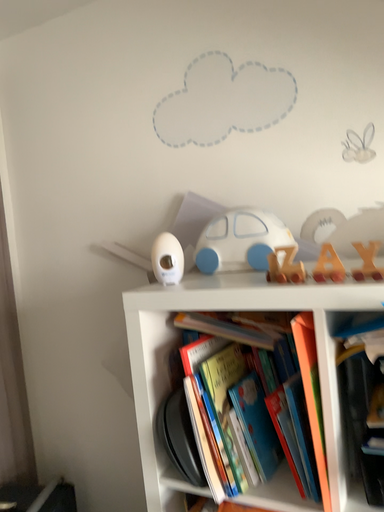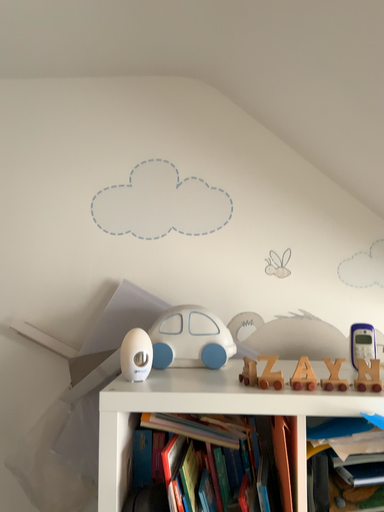
Question: Which way did the camera rotate in the video?

Choices:
 (A) rotated left
 (B) rotated right

Answer: (B)